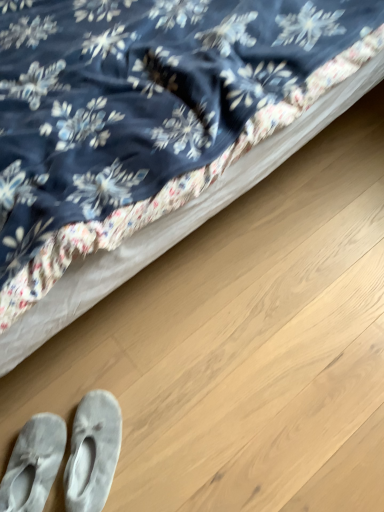
Locate an element on the screen. The width and height of the screenshot is (384, 512). vacant area that is situated to the right of gray suede slippers at lower left, the 2th footwear viewed from the right is located at coordinates (129, 449).